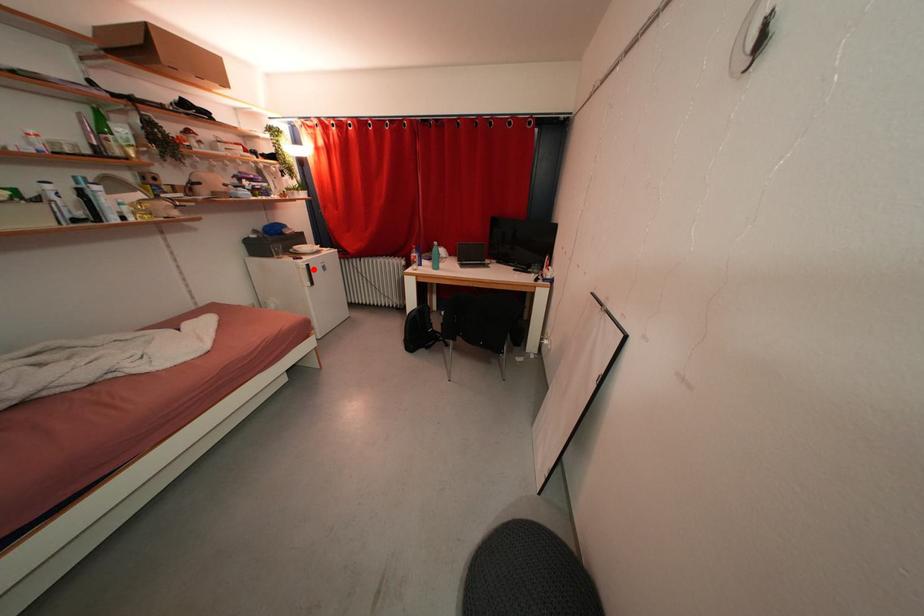
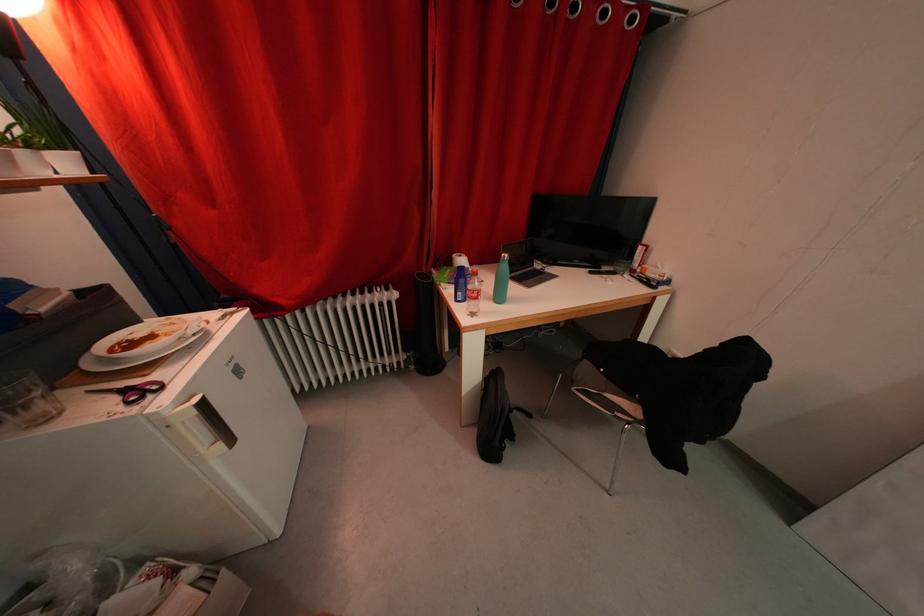
Question: I am providing you with two images of the same scene from different viewpoints. A red point is shown in image1. For the corresponding object point in image2, is it positioned nearer or farther from the camera?

Choices:
 (A) Nearer
 (B) Farther

Answer: (B)